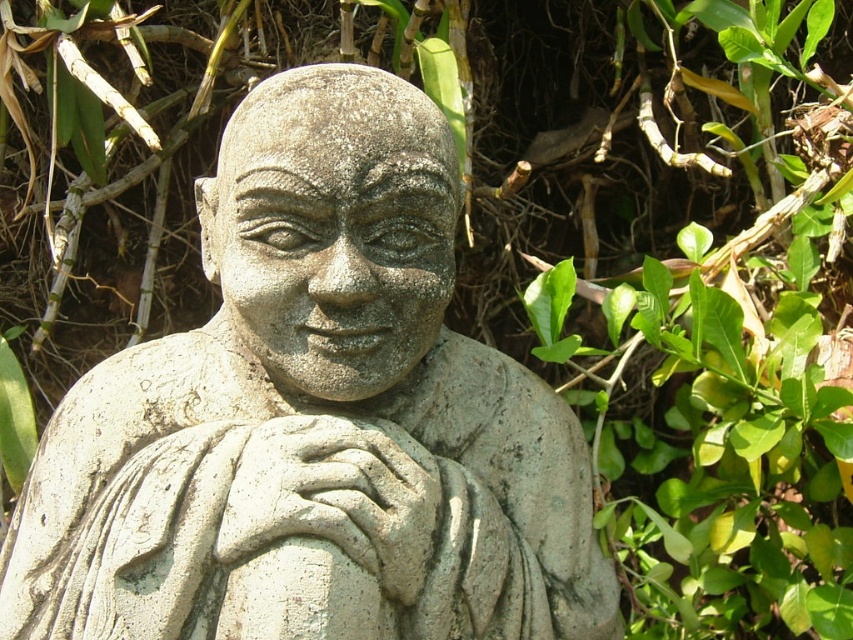
Question: Which point is farther to the camera?

Choices:
 (A) gray stone statue at center
 (B) gray stone hand at center

Answer: (B)

Question: Can you confirm if gray stone statue at center is positioned to the left of gray stone hand at center?

Choices:
 (A) yes
 (B) no

Answer: (B)

Question: Which object is farther from the camera taking this photo?

Choices:
 (A) gray stone hand at center
 (B) gray stone statue at center

Answer: (A)

Question: From the image, what is the correct spatial relationship of gray stone statue at center in relation to gray stone hand at center?

Choices:
 (A) left
 (B) right

Answer: (B)

Question: Can you confirm if gray stone statue at center is positioned to the left of gray stone hand at center?

Choices:
 (A) yes
 (B) no

Answer: (B)